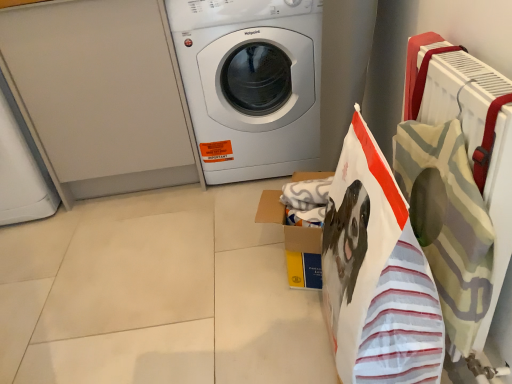
Question: From the image's perspective, is white striped fabric shopping bag at right located above yellow cardboard box at center?

Choices:
 (A) yes
 (B) no

Answer: (B)

Question: Is white striped fabric shopping bag at right far away from yellow cardboard box at center?

Choices:
 (A) no
 (B) yes

Answer: (A)

Question: Is white striped fabric shopping bag at right positioned behind yellow cardboard box at center?

Choices:
 (A) yes
 (B) no

Answer: (B)

Question: Would you say yellow cardboard box at center is part of white striped fabric shopping bag at right's contents?

Choices:
 (A) no
 (B) yes

Answer: (A)

Question: Can you confirm if white striped fabric shopping bag at right is thinner than yellow cardboard box at center?

Choices:
 (A) no
 (B) yes

Answer: (B)

Question: Is white striped fabric shopping bag at right at the left side of yellow cardboard box at center?

Choices:
 (A) no
 (B) yes

Answer: (A)

Question: Can you confirm if white striped fabric shopping bag at right is bigger than white glossy washing machine at center?

Choices:
 (A) yes
 (B) no

Answer: (B)

Question: Considering the relative positions of white striped fabric shopping bag at right and white glossy washing machine at center in the image provided, is white striped fabric shopping bag at right to the right of white glossy washing machine at center from the viewer's perspective?

Choices:
 (A) yes
 (B) no

Answer: (A)

Question: Is white striped fabric shopping bag at right in front of white glossy washing machine at center?

Choices:
 (A) yes
 (B) no

Answer: (A)

Question: Could you tell me if white striped fabric shopping bag at right is facing white glossy washing machine at center?

Choices:
 (A) yes
 (B) no

Answer: (B)

Question: Is white glossy washing machine at center completely or partially inside white striped fabric shopping bag at right?

Choices:
 (A) no
 (B) yes

Answer: (A)

Question: Would you say white striped fabric shopping bag at right is outside white glossy washing machine at center?

Choices:
 (A) no
 (B) yes

Answer: (B)

Question: Is white glossy washing machine at center thinner than yellow cardboard box at center?

Choices:
 (A) yes
 (B) no

Answer: (B)